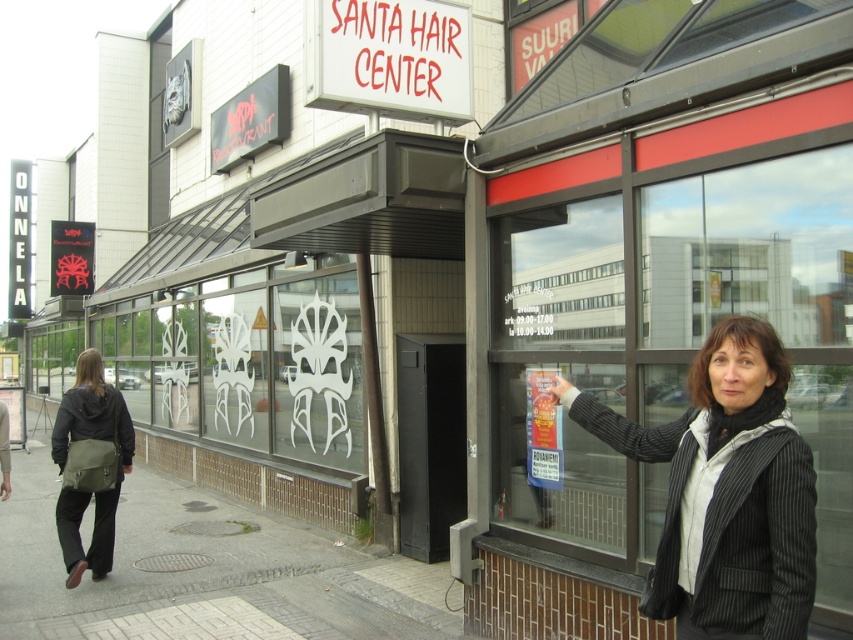
You are a delivery person trying to find the entrance to Santa Hair Center. You see a transparent glass window at center and a gray concrete sidewalk at lower left. Which object can help you locate the entrance?

The transparent glass window at center is larger and likely part of the storefront, so it can help locate the entrance to Santa Hair Center.

Consider the image. You are a delivery person with a cart that is 5 meters long. You need to move your cart from the gray concrete sidewalk at lower left to the transparent glass window at center. Is there enough space to move the cart directly between them?

The transparent glass window at center and gray concrete sidewalk at lower left are 4.98 meters apart from each other. Since the cart is 5 meters long, there isn not enough space to move the cart directly between them.

You are a delivery person trying to park your 2.5 meter long bike on the gray concrete sidewalk at lower left or the gray cobblestone pavement at lower left. Which surface can accommodate your bike without overhanging?

The gray cobblestone pavement at lower left is larger than the gray concrete sidewalk at lower left, so the bike can fit on the gray cobblestone pavement at lower left.